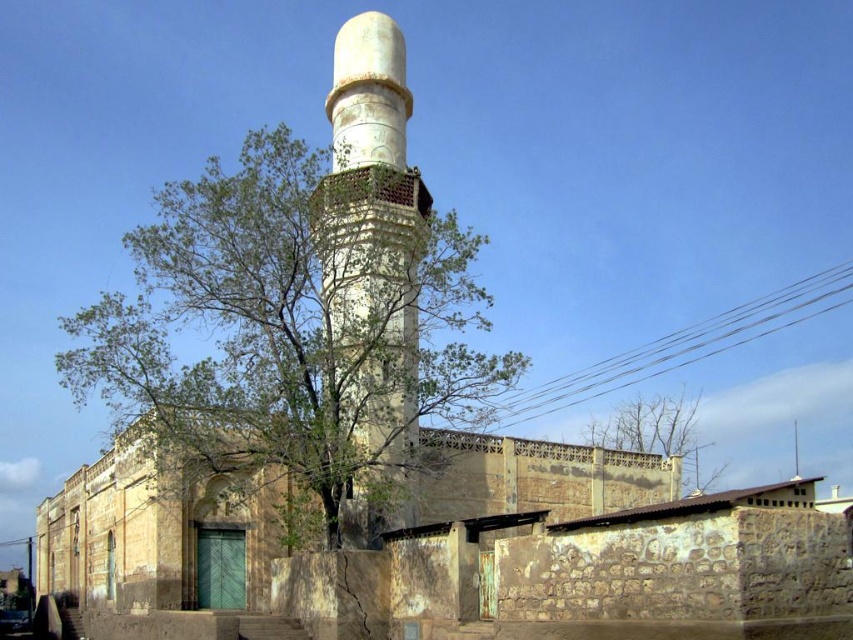
In the scene shown: Based on the scene description provided, where is the green leafy tree at center located in terms of coordinates?

The green leafy tree at center is located at point coordinates of 0.505 on the x axis and 0.342 on the y axis.

You are standing at the entrance of the mosque and want to find the green leafy tree at center. According to the spatial coordinates provided, in which direction should you look to see the tree?

The green leafy tree at center is located at point coordinates, so you should look towards the center of the scene to find it.

You are standing in front of the mosque and want to take a photo that includes both the green leafy tree at center and the white stone minaret at center. Which object should you position closer to the edge of the frame to ensure both fit in the shot?

The green leafy tree at center might be wider than the white stone minaret at center, so to ensure both fit in the shot, position the wider green leafy tree at center closer to the edge of the frame.